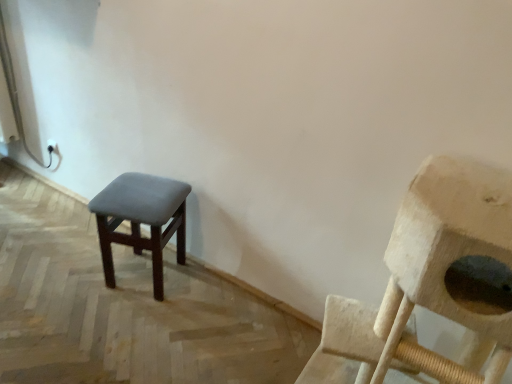
Identify the location of free location in front of dark gray fabric stool at left. This screenshot has width=512, height=384. (125, 324).